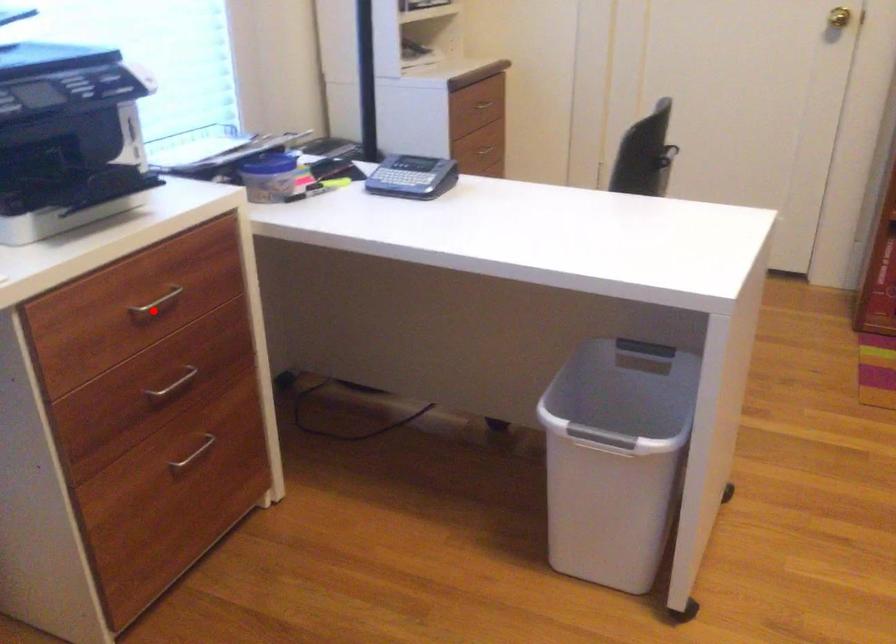
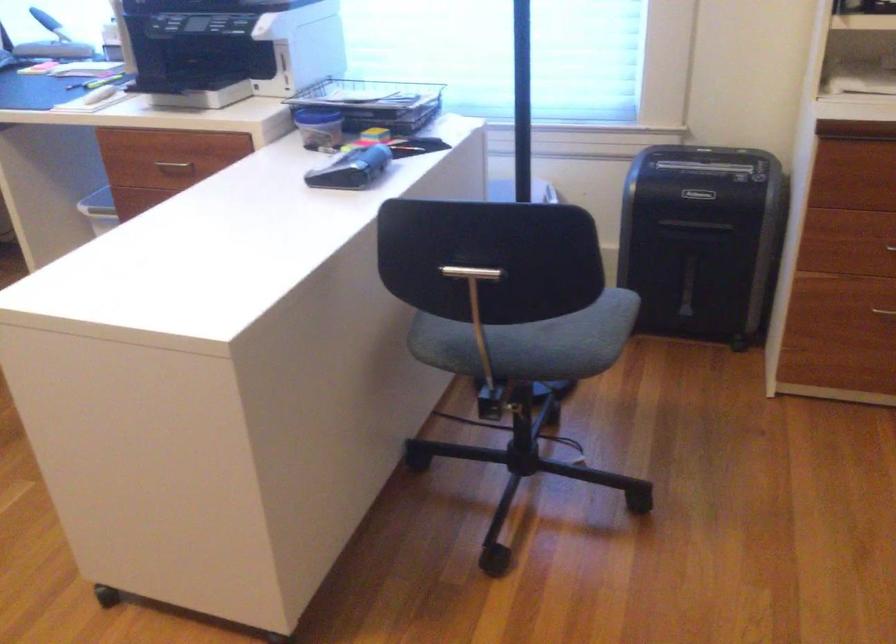
Question: A red point is marked in image1. In image2, is the corresponding 3D point closer to the camera or farther? Reply with the corresponding letter.

Choices:
 (A) The corresponding 3D point is closer.
 (B) The corresponding 3D point is farther.

Answer: (B)